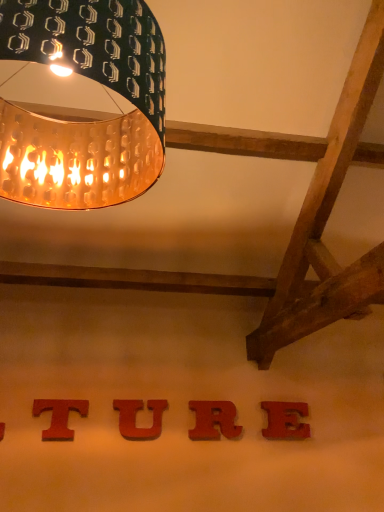
What do you see at coordinates (84, 122) in the screenshot? I see `gold perforated lampshade at upper left` at bounding box center [84, 122].

Identify the location of red matte letter e at center, the 4th alphabet viewed from the left. Image resolution: width=384 pixels, height=512 pixels. (285, 420).

At what (x,y) coordinates should I click in order to perform the action: click on red wood u at center, placed as the 3th alphabet when sorted from right to left. Please return your answer as a coordinate pair (x, y). Looking at the image, I should click on (135, 418).

Considering the sizes of objects gold perforated lampshade at upper left and red matte letter r at center, which is counted as the second alphabet, starting from the right, in the image provided, who is smaller, gold perforated lampshade at upper left or red matte letter r at center, which is counted as the second alphabet, starting from the right,?

red matte letter r at center, which is counted as the second alphabet, starting from the right, is smaller.

Is gold perforated lampshade at upper left facing away from red matte letter r at center, which is counted as the second alphabet, starting from the right?

No.

In the image, is gold perforated lampshade at upper left positioned in front of or behind red matte letter r at center, which ranks as the third alphabet in left-to-right order?

gold perforated lampshade at upper left is positioned closer to the viewer than red matte letter r at center, which ranks as the third alphabet in left-to-right order.

How many degrees apart are the facing directions of gold perforated lampshade at upper left and red matte letter r at center, which ranks as the third alphabet in left-to-right order?

1.26 degrees separate the facing orientations of gold perforated lampshade at upper left and red matte letter r at center, which ranks as the third alphabet in left-to-right order.

Can you tell me how much red matte letter e at center, the 4th alphabet viewed from the left, and red wood letter t at lower center, placed as the 1th alphabet when sorted from left to right, differ in facing direction?

red matte letter e at center, the 4th alphabet viewed from the left, and red wood letter t at lower center, placed as the 1th alphabet when sorted from left to right, are facing 0.00579 degrees away from each other.

How distant is red matte letter e at center, the 4th alphabet viewed from the left, from red wood letter t at lower center, placed as the 1th alphabet when sorted from left to right?

1.33 meters.

Is red matte letter e at center, the 4th alphabet viewed from the left, placed right next to red wood letter t at lower center, placed as the fourth alphabet when sorted from right to left?

red matte letter e at center, the 4th alphabet viewed from the left, and red wood letter t at lower center, placed as the fourth alphabet when sorted from right to left, are not in contact.

Considering the sizes of objects red matte letter e at center, the 4th alphabet viewed from the left, and red wood letter t at lower center, placed as the fourth alphabet when sorted from right to left, in the image provided, who is shorter, red matte letter e at center, the 4th alphabet viewed from the left, or red wood letter t at lower center, placed as the fourth alphabet when sorted from right to left,?

With less height is red wood letter t at lower center, placed as the fourth alphabet when sorted from right to left.

Does red wood u at center, the second alphabet in the left-to-right sequence, touch red matte letter r at center, which ranks as the third alphabet in left-to-right order?

red wood u at center, the second alphabet in the left-to-right sequence, and red matte letter r at center, which ranks as the third alphabet in left-to-right order, are clearly separated.

Looking at this image, is red wood u at center, the second alphabet in the left-to-right sequence, taller or shorter than red matte letter r at center, which ranks as the third alphabet in left-to-right order?

red wood u at center, the second alphabet in the left-to-right sequence, is shorter than red matte letter r at center, which ranks as the third alphabet in left-to-right order.

Between red wood u at center, placed as the 3th alphabet when sorted from right to left, and red matte letter r at center, which is counted as the second alphabet, starting from the right, which one is positioned behind?

red matte letter r at center, which is counted as the second alphabet, starting from the right, is behind.

How much distance is there between red wood u at center, placed as the 3th alphabet when sorted from right to left, and red matte letter r at center, which is counted as the second alphabet, starting from the right?

red wood u at center, placed as the 3th alphabet when sorted from right to left, is 13.35 inches away from red matte letter r at center, which is counted as the second alphabet, starting from the right.

Considering the sizes of objects red wood letter t at lower center, placed as the fourth alphabet when sorted from right to left, and red matte letter e at center, the 4th alphabet viewed from the left, in the image provided, who is shorter, red wood letter t at lower center, placed as the fourth alphabet when sorted from right to left, or red matte letter e at center, the 4th alphabet viewed from the left,?

red wood letter t at lower center, placed as the fourth alphabet when sorted from right to left, is shorter.

Is red wood letter t at lower center, placed as the fourth alphabet when sorted from right to left, aimed at red matte letter e at center, the 4th alphabet viewed from the left?

No, red wood letter t at lower center, placed as the fourth alphabet when sorted from right to left, is not aimed at red matte letter e at center, the 4th alphabet viewed from the left.

Which point is more forward, (54, 404) or (270, 429)?

The point (54, 404) is more forward.

In the scene shown: Would you say red matte letter e at center, marked as the first alphabet in a right-to-left arrangement, is part of red wood letter t at lower center, placed as the fourth alphabet when sorted from right to left,'s contents?

No, red matte letter e at center, marked as the first alphabet in a right-to-left arrangement, is not a part of red wood letter t at lower center, placed as the fourth alphabet when sorted from right to left.

Which of these two, red wood letter t at lower center, placed as the 1th alphabet when sorted from left to right, or red matte letter r at center, which ranks as the third alphabet in left-to-right order, is thinner?

red wood letter t at lower center, placed as the 1th alphabet when sorted from left to right.

The width and height of the screenshot is (384, 512). Identify the location of alphabet that is above the red matte letter r at center, which is counted as the second alphabet, starting from the right (from a real-world perspective). (59, 416).

Is red wood letter t at lower center, placed as the 1th alphabet when sorted from left to right, facing away from red matte letter r at center, which ranks as the third alphabet in left-to-right order?

No.

Does red wood letter t at lower center, placed as the fourth alphabet when sorted from right to left, touch red matte letter r at center, which ranks as the third alphabet in left-to-right order?

No, red wood letter t at lower center, placed as the fourth alphabet when sorted from right to left, is not making contact with red matte letter r at center, which ranks as the third alphabet in left-to-right order.

Is point (25, 1) in front of point (128, 401)?

Yes.

Is red wood u at center, the second alphabet in the left-to-right sequence, at the back of gold perforated lampshade at upper left?

Yes, gold perforated lampshade at upper left is positioned with its back facing red wood u at center, the second alphabet in the left-to-right sequence.

Between gold perforated lampshade at upper left and red wood u at center, placed as the 3th alphabet when sorted from right to left, which one appears on the left side from the viewer's perspective?

gold perforated lampshade at upper left is more to the left.

Can you confirm if gold perforated lampshade at upper left is thinner than red wood letter t at lower center, placed as the fourth alphabet when sorted from right to left?

In fact, gold perforated lampshade at upper left might be wider than red wood letter t at lower center, placed as the fourth alphabet when sorted from right to left.

Measure the distance between gold perforated lampshade at upper left and red wood letter t at lower center, placed as the fourth alphabet when sorted from right to left.

1.94 meters.

Can you tell me how much gold perforated lampshade at upper left and red wood letter t at lower center, placed as the fourth alphabet when sorted from right to left, differ in facing direction?

There is a 1.26-degree angle between the facing directions of gold perforated lampshade at upper left and red wood letter t at lower center, placed as the fourth alphabet when sorted from right to left.

From the image's perspective, is gold perforated lampshade at upper left below red wood letter t at lower center, placed as the 1th alphabet when sorted from left to right?

No.

Locate an element on the screen. lamp on the left of red matte letter r at center, which ranks as the third alphabet in left-to-right order is located at coordinates (84, 122).

The height and width of the screenshot is (512, 384). I want to click on the 3rd alphabet behind the red wood letter t at lower center, placed as the 1th alphabet when sorted from left to right, counting from the anchor's position, so click(285, 420).

Considering their positions, is red wood u at center, the second alphabet in the left-to-right sequence, positioned further to red matte letter e at center, the 4th alphabet viewed from the left, than red matte letter r at center, which is counted as the second alphabet, starting from the right?

red wood u at center, the second alphabet in the left-to-right sequence, lies further to red matte letter e at center, the 4th alphabet viewed from the left, than the other object.

Based on their spatial positions, is red matte letter e at center, marked as the first alphabet in a right-to-left arrangement, or gold perforated lampshade at upper left closer to red wood letter t at lower center, placed as the 1th alphabet when sorted from left to right?

red matte letter e at center, marked as the first alphabet in a right-to-left arrangement.

Looking at the image, which one is located further to red wood letter t at lower center, placed as the fourth alphabet when sorted from right to left, red wood u at center, placed as the 3th alphabet when sorted from right to left, or red matte letter r at center, which is counted as the second alphabet, starting from the right?

Based on the image, red matte letter r at center, which is counted as the second alphabet, starting from the right, appears to be further to red wood letter t at lower center, placed as the fourth alphabet when sorted from right to left.

Which object lies further to the anchor point red wood letter t at lower center, placed as the fourth alphabet when sorted from right to left, red wood u at center, the second alphabet in the left-to-right sequence, or gold perforated lampshade at upper left?

gold perforated lampshade at upper left is positioned further to the anchor red wood letter t at lower center, placed as the fourth alphabet when sorted from right to left.

Looking at the image, which one is located closer to red wood letter t at lower center, placed as the fourth alphabet when sorted from right to left, gold perforated lampshade at upper left or red wood u at center, the second alphabet in the left-to-right sequence?

The object closer to red wood letter t at lower center, placed as the fourth alphabet when sorted from right to left, is red wood u at center, the second alphabet in the left-to-right sequence.

Estimate the real-world distances between objects in this image. Which object is closer to red matte letter r at center, which ranks as the third alphabet in left-to-right order, red wood letter t at lower center, placed as the 1th alphabet when sorted from left to right, or red matte letter e at center, marked as the first alphabet in a right-to-left arrangement?

Among the two, red matte letter e at center, marked as the first alphabet in a right-to-left arrangement, is located nearer to red matte letter r at center, which ranks as the third alphabet in left-to-right order.

Which object lies nearer to the anchor point red matte letter e at center, the 4th alphabet viewed from the left, gold perforated lampshade at upper left or red wood u at center, placed as the 3th alphabet when sorted from right to left?

red wood u at center, placed as the 3th alphabet when sorted from right to left.

Estimate the real-world distances between objects in this image. Which object is closer to red wood letter t at lower center, placed as the fourth alphabet when sorted from right to left, red matte letter r at center, which is counted as the second alphabet, starting from the right, or gold perforated lampshade at upper left?

Based on the image, red matte letter r at center, which is counted as the second alphabet, starting from the right, appears to be nearer to red wood letter t at lower center, placed as the fourth alphabet when sorted from right to left.

At what (x,y) coordinates should I click in order to perform the action: click on alphabet positioned between gold perforated lampshade at upper left and red wood u at center, the second alphabet in the left-to-right sequence, from near to far. Please return your answer as a coordinate pair (x, y). Looking at the image, I should click on (59, 416).

The height and width of the screenshot is (512, 384). What are the coordinates of `alphabet located between red wood u at center, placed as the 3th alphabet when sorted from right to left, and red matte letter e at center, marked as the first alphabet in a right-to-left arrangement, in the left-right direction` in the screenshot? It's located at click(214, 420).

You are a GUI agent. You are given a task and a screenshot of the screen. Output one action in this format:
    pyautogui.click(x=<x>, y=<y>)
    Task: Click on the alphabet situated between red wood letter t at lower center, placed as the 1th alphabet when sorted from left to right, and red matte letter r at center, which ranks as the third alphabet in left-to-right order, from left to right
    The image size is (384, 512).
    Given the screenshot: What is the action you would take?
    pyautogui.click(x=135, y=418)